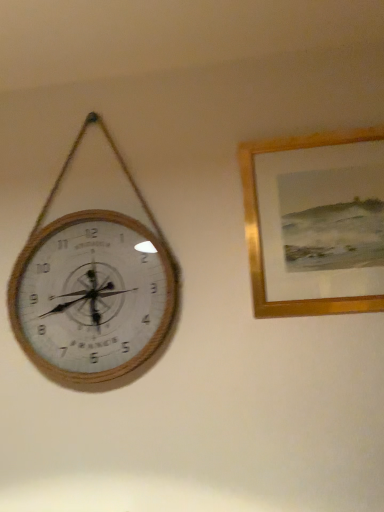
Question: Is gold wooden picture frame at upper right turned away from wooden clock at left?

Choices:
 (A) yes
 (B) no

Answer: (B)

Question: Is gold wooden picture frame at upper right in front of wooden clock at left?

Choices:
 (A) no
 (B) yes

Answer: (B)

Question: Would you consider gold wooden picture frame at upper right to be distant from wooden clock at left?

Choices:
 (A) no
 (B) yes

Answer: (A)

Question: Is wooden clock at left located within gold wooden picture frame at upper right?

Choices:
 (A) no
 (B) yes

Answer: (A)

Question: Considering the relative sizes of gold wooden picture frame at upper right and wooden clock at left in the image provided, is gold wooden picture frame at upper right thinner than wooden clock at left?

Choices:
 (A) no
 (B) yes

Answer: (B)

Question: From a real-world perspective, does gold wooden picture frame at upper right sit lower than wooden clock at left?

Choices:
 (A) no
 (B) yes

Answer: (B)

Question: Could you tell me if wooden clock at left is facing gold wooden picture frame at upper right?

Choices:
 (A) yes
 (B) no

Answer: (B)

Question: Is wooden clock at left further to the viewer compared to gold wooden picture frame at upper right?

Choices:
 (A) yes
 (B) no

Answer: (A)

Question: Is wooden clock at left taller than gold wooden picture frame at upper right?

Choices:
 (A) no
 (B) yes

Answer: (B)

Question: From the image's perspective, would you say wooden clock at left is shown under gold wooden picture frame at upper right?

Choices:
 (A) no
 (B) yes

Answer: (B)

Question: Does wooden clock at left have a larger size compared to gold wooden picture frame at upper right?

Choices:
 (A) yes
 (B) no

Answer: (A)

Question: Would you say wooden clock at left contains gold wooden picture frame at upper right?

Choices:
 (A) yes
 (B) no

Answer: (B)

Question: From the image's perspective, is gold wooden picture frame at upper right located above or below wooden clock at left?

Choices:
 (A) below
 (B) above

Answer: (B)